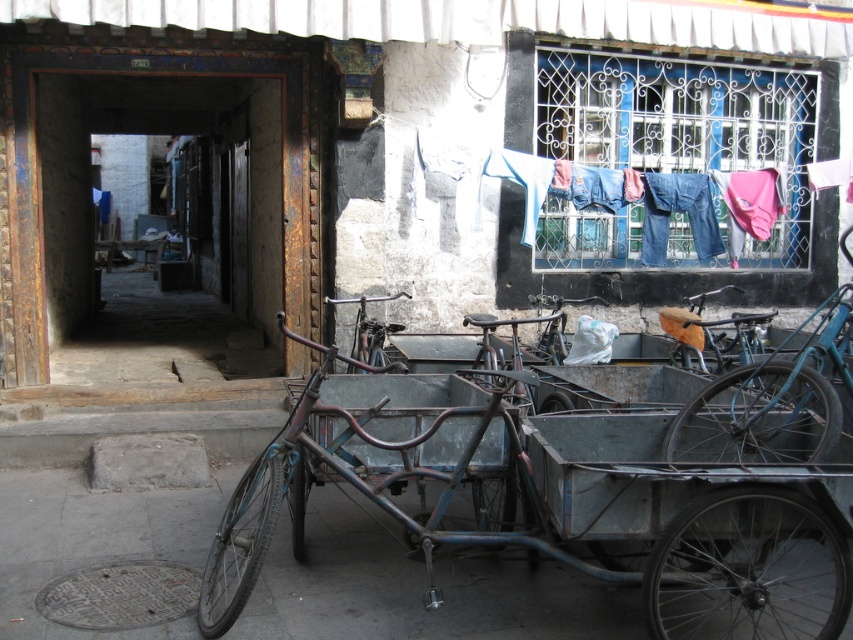
You are standing at the point with coordinates point [569,221] and want to walk to the point with coordinates point [677,621]. Which direction should you face to move towards your destination?

You should face forward because point [677,621] is in front of point [569,221].

You are standing on the street and want to hang your laundry on the window grills. The window has two items already present. Which item is closer to you, the denim jeans at upper right or the rusty metal bicycle at center?

The denim jeans at upper right are closer to you because they are further to the viewer than the rusty metal bicycle at center.